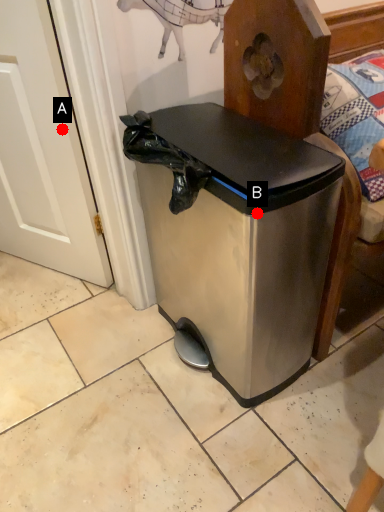
Question: Two points are circled on the image, labeled by A and B beside each circle. Which point is farther from the camera taking this photo?

Choices:
 (A) A is further
 (B) B is further

Answer: (A)